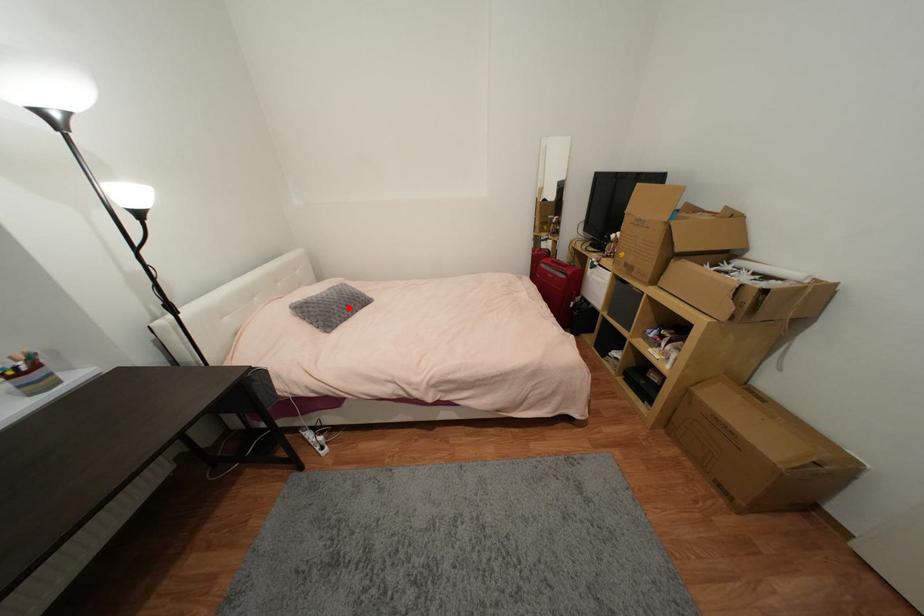
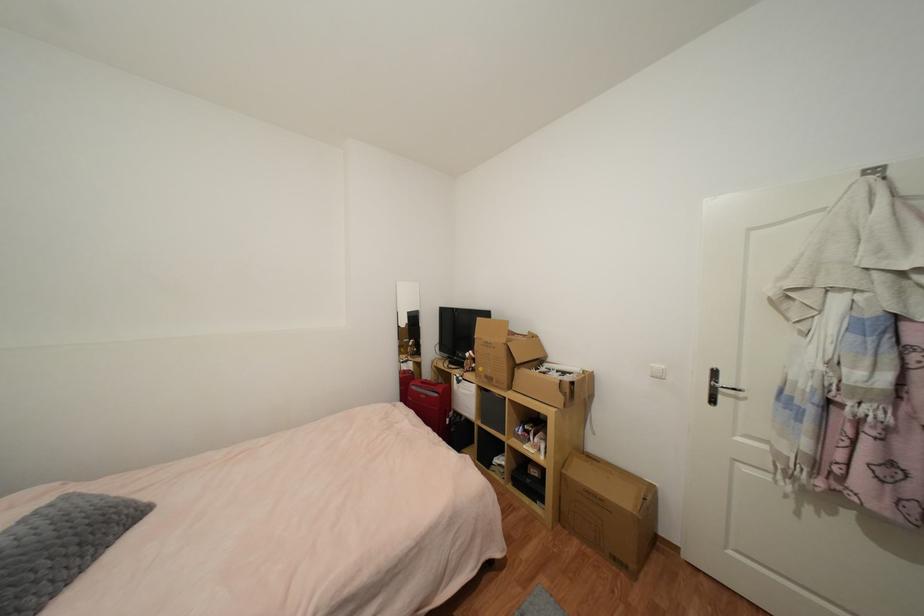
In the second image, find the point that corresponds to the highlighted location in the first image.

(79, 551)